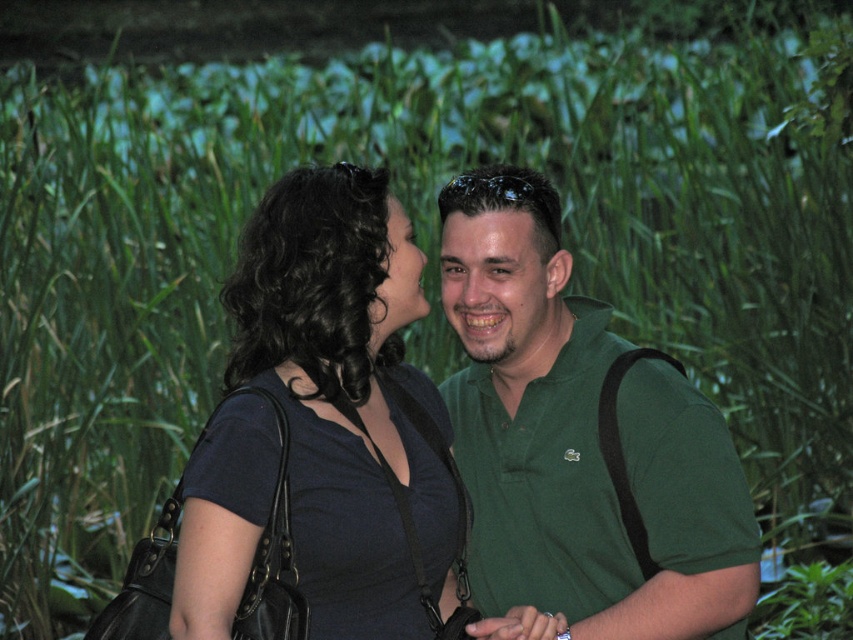
Based on the photo, you are a photographer trying to capture a candid shot of the two people in the image. Since the matte black dress at center is behind the green matte shirt at center, will you need to adjust your angle to ensure both are fully visible in the photo?

Yes, since the matte black dress at center is behind the green matte shirt at center, you may need to adjust your angle to ensure both are fully visible in the photo.

You are an artist trying to sketch the scene. You need to place the green matte shirt at center accurately. According to the coordinates provided, where should you position it on your drawing canvas?

The green matte shirt at center should be positioned at coordinates point (581,440).

Looking at this image, you are a photographer setting up for a group photo. You need to ensure that the two subjects, the green matte shirt at center and the matte black dress at center, are positioned within a 24 inch frame. Based on their current distance, will they fit comfortably within this frame?

The distance between the green matte shirt at center and the matte black dress at center is 20.66 inches, which is less than 24 inches. Therefore, they will fit comfortably within the frame.